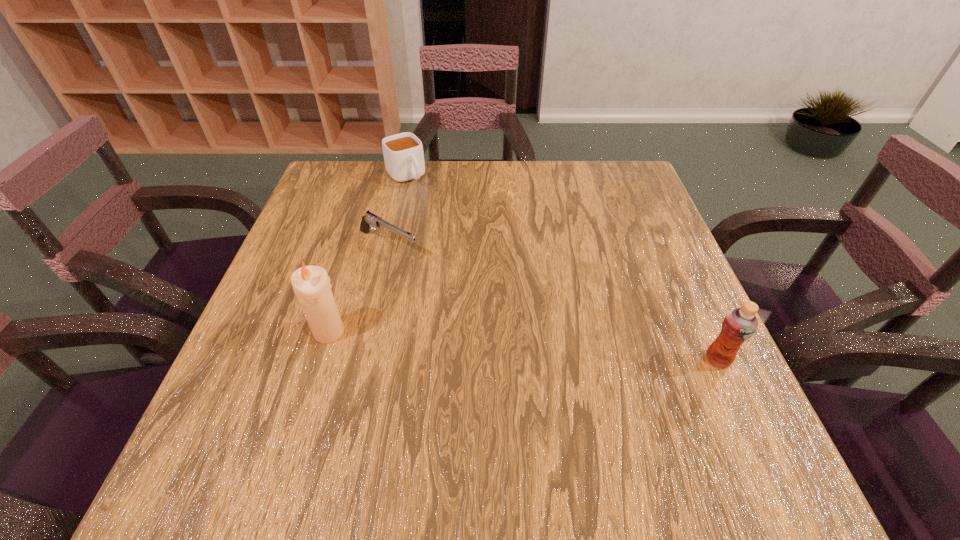
Where is `vacant area that lies between the shortest object and the cup`? This screenshot has height=540, width=960. vacant area that lies between the shortest object and the cup is located at coordinates (396, 211).

At what (x,y) coordinates should I click in order to perform the action: click on free space between the candle and the second shortest object. Please return your answer as a coordinate pair (x, y). This screenshot has height=540, width=960. Looking at the image, I should click on 368,254.

The height and width of the screenshot is (540, 960). What are the coordinates of `vacant space that is in between the pistol and the farthest object` in the screenshot? It's located at (396, 211).

Identify the location of empty location between the orange juice and the pistol. (553, 302).

Locate an element on the screen. free spot between the second farthest object and the tallest object is located at coordinates (359, 288).

Identify the location of vacant region between the cup and the orange juice. (562, 268).

Choose which object is the third nearest neighbor to the candle. Please provide its 2D coordinates. Your answer should be formatted as a tuple, i.e. [(x, y)], where the tuple contains the x and y coordinates of a point satisfying the conditions above.

[(739, 324)]

Identify which object is the closest to the third tallest object. Please provide its 2D coordinates. Your answer should be formatted as a tuple, i.e. [(x, y)], where the tuple contains the x and y coordinates of a point satisfying the conditions above.

[(369, 220)]

Identify the location of free space that satisfies the following two spatial constraints: 1. on the back side of the candle; 2. on the left side of the third nearest object. The height and width of the screenshot is (540, 960). (356, 245).

This screenshot has width=960, height=540. I want to click on vacant space that satisfies the following two spatial constraints: 1. on the back side of the second farthest object; 2. on the right side of the third tallest object, so click(403, 176).